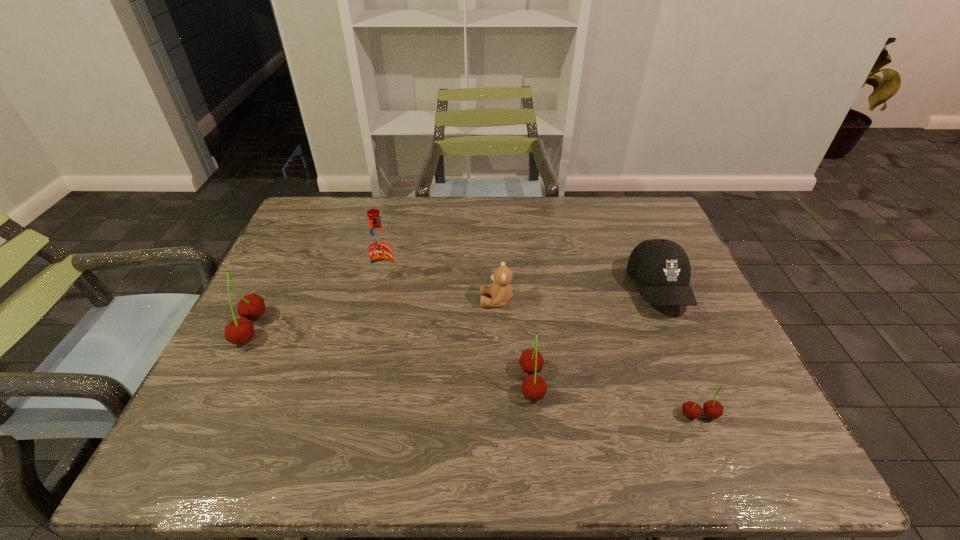
At what (x,y) coordinates should I click in order to perform the action: click on empty space between the shortest cherry and the root beer. Please return your answer as a coordinate pair (x, y). The width and height of the screenshot is (960, 540). Looking at the image, I should click on (542, 348).

Identify the location of vacant point located between the leftmost object and the third object from left to right. (373, 315).

The width and height of the screenshot is (960, 540). Identify the location of unoccupied area between the teddy bear and the leftmost cherry. (373, 315).

You are a GUI agent. You are given a task and a screenshot of the screen. Output one action in this format:
    pyautogui.click(x=<x>, y=<y>)
    Task: Click on the blank region between the shortest cherry and the fourth object from left to right
    Image resolution: width=960 pixels, height=540 pixels.
    Given the screenshot: What is the action you would take?
    pyautogui.click(x=615, y=399)

Identify the location of blank region between the leftmost object and the shortest cherry. This screenshot has width=960, height=540. (475, 372).

Locate an element on the screen. The image size is (960, 540). vacant region between the shortest cherry and the tallest object is located at coordinates (542, 348).

Find the location of a particular element. This screenshot has height=540, width=960. vacant space that is in between the second shortest cherry and the baseball cap is located at coordinates (595, 336).

Locate an element on the screen. This screenshot has width=960, height=540. vacant point located between the third tallest object and the shortest cherry is located at coordinates (615, 399).

What are the coordinates of `object that is the fifth closest to the tallest object` in the screenshot? It's located at (713, 409).

Where is `object identified as the fifth closest to the leftmost cherry`? The image size is (960, 540). object identified as the fifth closest to the leftmost cherry is located at coordinates (713, 409).